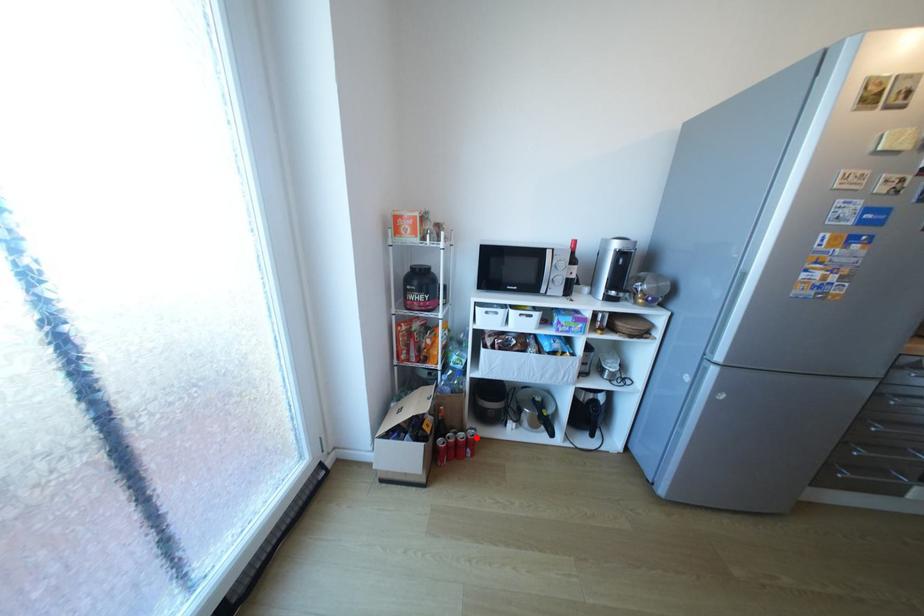
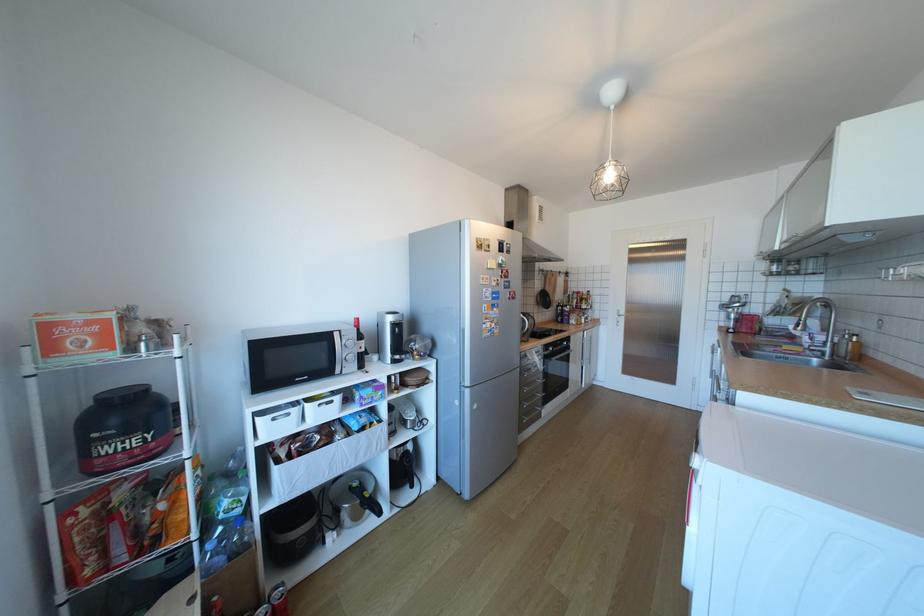
Where in the second image is the point corresponding to the highlighted location from the first image?

(283, 607)